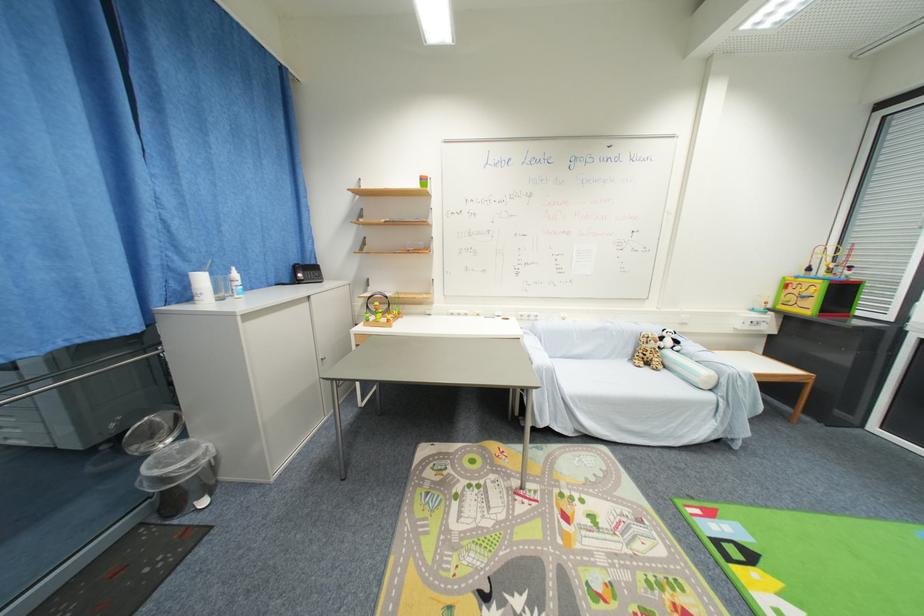
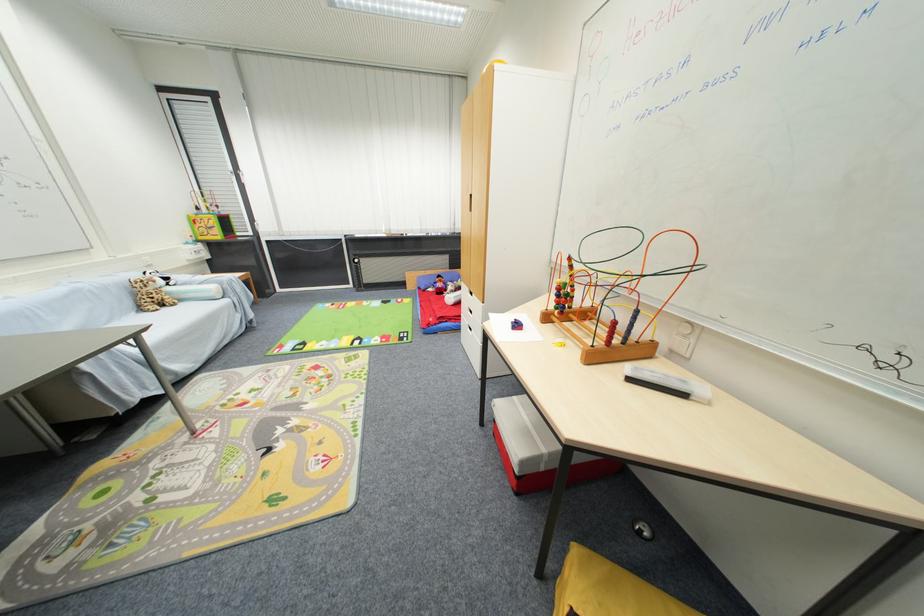
Where in the second image is the point corresponding to [638,361] from the first image?

(146, 310)